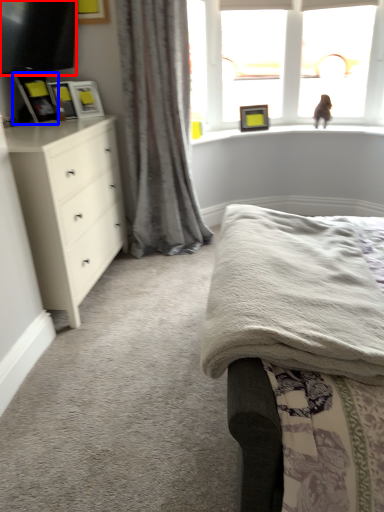
Question: Among these objects, which one is nearest to the camera, television (highlighted by a red box) or picture frame (highlighted by a blue box)?

Choices:
 (A) television
 (B) picture frame

Answer: (A)